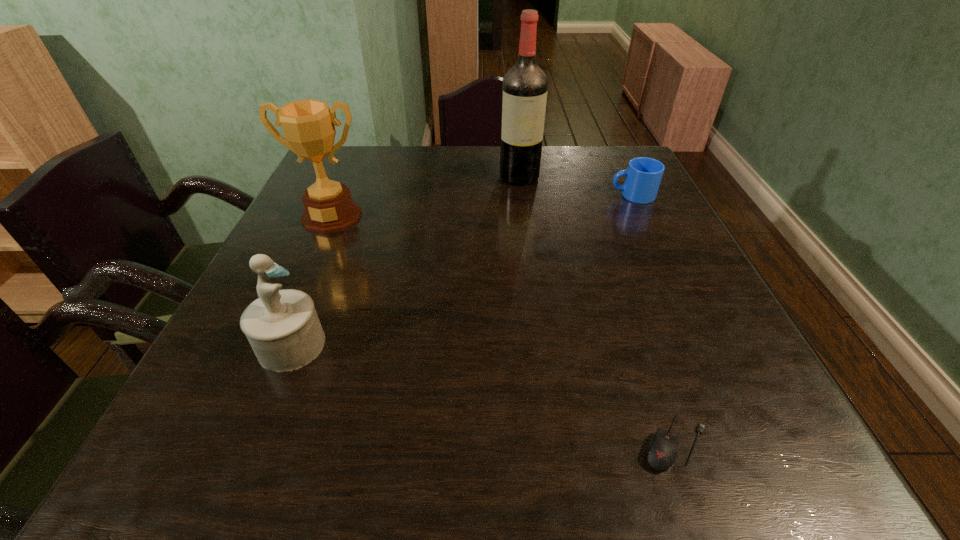
I want to click on liquor, so click(x=524, y=88).

Identify the location of the tallest object. (524, 88).

At what (x,y) coordinates should I click in order to perform the action: click on the second tallest object. Please return your answer as a coordinate pair (x, y). Looking at the image, I should click on (308, 125).

Find the location of `figurine`. figurine is located at coordinates (282, 326).

Where is `the third tallest object`? This screenshot has width=960, height=540. the third tallest object is located at coordinates (282, 326).

Image resolution: width=960 pixels, height=540 pixels. In order to click on mug in this screenshot , I will do `click(643, 177)`.

This screenshot has width=960, height=540. I want to click on the rightmost object, so click(643, 177).

Identify the location of the shortest object. (662, 453).

Image resolution: width=960 pixels, height=540 pixels. In order to click on the second object from right to left in this screenshot , I will do `click(662, 453)`.

This screenshot has height=540, width=960. Identify the location of blank space located 0.090m on the front-facing side of the third object from right to left. click(523, 205).